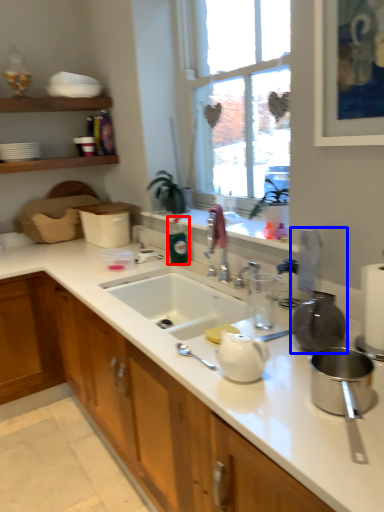
Question: Which point is closer to the camera, bottle (highlighted by a red box) or appliance (highlighted by a blue box)?

Choices:
 (A) bottle
 (B) appliance

Answer: (B)